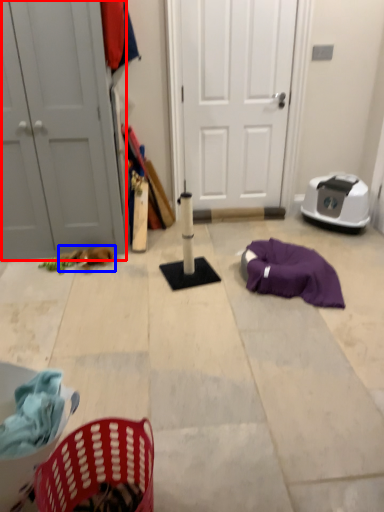
Question: Which point is further to the camera, door (highlighted by a red box) or animal (highlighted by a blue box)?

Choices:
 (A) door
 (B) animal

Answer: (B)